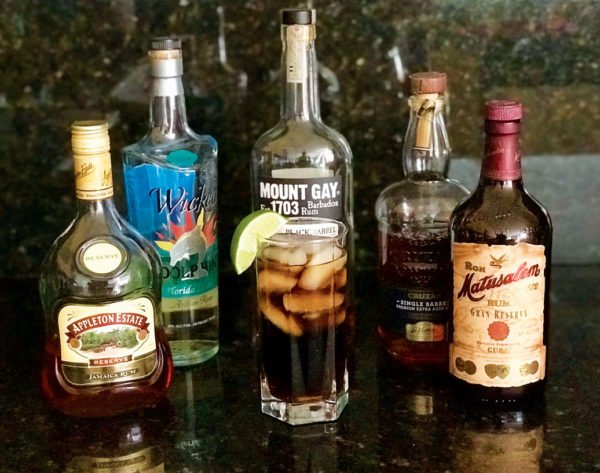
Locate an element on the screen. The width and height of the screenshot is (600, 473). glass is located at coordinates [314, 364].